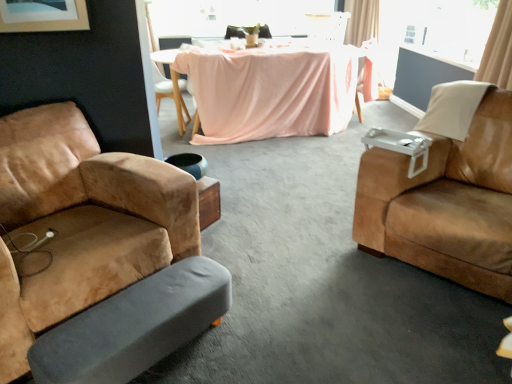
The height and width of the screenshot is (384, 512). Describe the element at coordinates (275, 89) in the screenshot. I see `pink fabric-covered table at center` at that location.

You are a GUI agent. You are given a task and a screenshot of the screen. Output one action in this format:
    pyautogui.click(x=<x>, y=<y>)
    Task: Click on the pink fabric-covered table at center
    The height and width of the screenshot is (384, 512).
    Given the screenshot: What is the action you would take?
    [x=275, y=89]

The width and height of the screenshot is (512, 384). What do you see at coordinates (446, 203) in the screenshot?
I see `suede brown couch at right, placed as the third chair when sorted from back to front` at bounding box center [446, 203].

Describe the element at coordinates (170, 95) in the screenshot. This screenshot has height=384, width=512. I see `white wood chair at upper center, which is the 4th chair in right-to-left order` at that location.

Where is `white glossy armchair at upper center`? white glossy armchair at upper center is located at coordinates (327, 26).

Is point (163, 344) behind point (355, 40)?

No, (163, 344) is in front of (355, 40).

Who is more distant, gray fabric footrest at lower left or beige fabric curtain at upper right, the 2th curtain from the bottom?

Positioned behind is beige fabric curtain at upper right, the 2th curtain from the bottom.

Based on the photo, from a real-world perspective, is gray fabric footrest at lower left physically above beige fabric curtain at upper right, positioned as the 1th curtain in back-to-front order?

No.

Starting from the beige fabric curtain at upper right, the 1th curtain when ordered from bottom to top, which chair is the 2nd one to the left? Please provide its 2D coordinates.

[(446, 203)]

Is suede brown couch at right, the 3th chair when ordered from left to right, taller or shorter than beige fabric curtain at upper right, the 2th curtain from the top?

In the image, suede brown couch at right, the 3th chair when ordered from left to right, appears to be taller than beige fabric curtain at upper right, the 2th curtain from the top.

Is suede brown couch at right, placed as the third chair when sorted from back to front, positioned before beige fabric curtain at upper right, which is the 1th curtain in front-to-back order?

Yes, suede brown couch at right, placed as the third chair when sorted from back to front, is closer to the camera.

Measure the distance from pink fabric-covered table at center to suede brown couch at right, placed as the third chair when sorted from back to front.

pink fabric-covered table at center is 6.80 feet away from suede brown couch at right, placed as the third chair when sorted from back to front.

Is pink fabric-covered table at center at the right side of suede brown couch at right, placed as the third chair when sorted from back to front?

In fact, pink fabric-covered table at center is to the left of suede brown couch at right, placed as the third chair when sorted from back to front.

Are pink fabric-covered table at center and suede brown couch at right, the 3th chair when ordered from left to right, making contact?

No, pink fabric-covered table at center is not making contact with suede brown couch at right, the 3th chair when ordered from left to right.

Consider the image. From the image's perspective, who appears lower, pink fabric-covered table at center or suede brown couch at right, the 3th chair when ordered from left to right?

suede brown couch at right, the 3th chair when ordered from left to right, from the image's perspective.

Which object is wider, suede brown couch at right, acting as the second chair starting from the front, or pink fabric-covered table at center?

Wider between the two is suede brown couch at right, acting as the second chair starting from the front.

Which of these two, suede brown couch at right, the 3th chair when ordered from left to right, or pink fabric-covered table at center, stands taller?

suede brown couch at right, the 3th chair when ordered from left to right, is taller.

From a real-world perspective, is suede brown couch at right, placed as the third chair when sorted from back to front, beneath pink fabric-covered table at center?

Incorrect, from a real-world perspective, suede brown couch at right, placed as the third chair when sorted from back to front, is higher than pink fabric-covered table at center.

Considering the positions of objects suede brown couch at right, which appears as the 2th chair when viewed from the right, and pink fabric-covered table at center in the image provided, who is behind, suede brown couch at right, which appears as the 2th chair when viewed from the right, or pink fabric-covered table at center?

pink fabric-covered table at center.

Is wooden picture frame at upper left next to white glossy armchair at upper center and touching it?

They are not placed beside each other.

Is wooden picture frame at upper left turned away from white glossy armchair at upper center?

No, white glossy armchair at upper center is not at the back of wooden picture frame at upper left.

Between wooden picture frame at upper left and white glossy armchair at upper center, which one has smaller size?

wooden picture frame at upper left.

The image size is (512, 384). Identify the location of armchair on the right side of wooden picture frame at upper left. click(327, 26).

Relative to pink fabric-covered table at center, is beige fabric curtain at upper right, the 2th curtain from the bottom, in front or behind?

In the image, beige fabric curtain at upper right, the 2th curtain from the bottom, appears behind pink fabric-covered table at center.

Locate an element on the screen. This screenshot has height=384, width=512. the 1st curtain to the right of the pink fabric-covered table at center, starting your count from the anchor is located at coordinates (362, 21).

Between beige fabric curtain at upper right, the 1th curtain positioned from the top, and pink fabric-covered table at center, which one has more height?

beige fabric curtain at upper right, the 1th curtain positioned from the top.

Considering the sizes of objects beige fabric curtain at upper right, the 1th curtain positioned from the top, and pink fabric-covered table at center in the image provided, who is thinner, beige fabric curtain at upper right, the 1th curtain positioned from the top, or pink fabric-covered table at center?

With smaller width is beige fabric curtain at upper right, the 1th curtain positioned from the top.

Is matte pink fabric chair at center, which is the 4th chair in left-to-right order, inside or outside of transparent glass window at upper center?

matte pink fabric chair at center, which is the 4th chair in left-to-right order, is located beyond the bounds of transparent glass window at upper center.

Does matte pink fabric chair at center, which is the 4th chair in left-to-right order, turn towards transparent glass window at upper center?

No, matte pink fabric chair at center, which is the 4th chair in left-to-right order, is not aimed at transparent glass window at upper center.

Which of these two, matte pink fabric chair at center, which appears as the first chair when viewed from the right, or transparent glass window at upper center, is bigger?

Bigger between the two is transparent glass window at upper center.

You are a GUI agent. You are given a task and a screenshot of the screen. Output one action in this format:
    pyautogui.click(x=<x>, y=<y>)
    Task: Click on the footrest below the beige fabric curtain at upper right, positioned as the 2th curtain in front-to-back order (from the image's perspective)
    This screenshot has width=512, height=384.
    Given the screenshot: What is the action you would take?
    pyautogui.click(x=134, y=326)

Starting from the beige fabric curtain at upper right, the 2th curtain from the back, which chair is the 2nd one to the left? Please provide its 2D coordinates.

[(446, 203)]

From the image, which object appears to be farther from beige fabric curtain at upper right, positioned as the 2th curtain in front-to-back order, beige fabric curtain at upper right, which is the 1th curtain in front-to-back order, or white glossy armchair at upper center?

beige fabric curtain at upper right, which is the 1th curtain in front-to-back order, is positioned further to the anchor beige fabric curtain at upper right, positioned as the 2th curtain in front-to-back order.

Estimate the real-world distances between objects in this image. Which object is further from suede tan armchair at left, which is the first chair in front-to-back order, beige fabric curtain at upper right, which is the 1th curtain in front-to-back order, or suede brown couch at right, acting as the second chair starting from the front?

Among the two, beige fabric curtain at upper right, which is the 1th curtain in front-to-back order, is located further to suede tan armchair at left, which is the first chair in front-to-back order.

Considering their positions, is beige fabric curtain at upper right, positioned as the 1th curtain in back-to-front order, positioned closer to wooden picture frame at upper left than white wood chair at upper center, which is counted as the second chair, starting from the back?

white wood chair at upper center, which is counted as the second chair, starting from the back, is positioned closer to the anchor wooden picture frame at upper left.

Considering their positions, is suede tan armchair at left, which is the first chair in front-to-back order, positioned further to gray fabric footrest at lower left than transparent glass window at upper center?

Based on the image, transparent glass window at upper center appears to be further to gray fabric footrest at lower left.

When comparing their distances from suede brown couch at right, acting as the second chair starting from the front, does wooden picture frame at upper left or matte pink fabric chair at center, which is the 1th chair in back-to-front order, seem further?

Among the two, matte pink fabric chair at center, which is the 1th chair in back-to-front order, is located further to suede brown couch at right, acting as the second chair starting from the front.

Which object lies nearer to the anchor point pink fabric-covered table at center, gray fabric footrest at lower left or matte pink fabric chair at center, which is the 4th chair in left-to-right order?

The object closer to pink fabric-covered table at center is matte pink fabric chair at center, which is the 4th chair in left-to-right order.

Based on their spatial positions, is gray fabric footrest at lower left or wooden picture frame at upper left closer to beige fabric curtain at upper right, positioned as the 2th curtain in front-to-back order?

wooden picture frame at upper left is closer to beige fabric curtain at upper right, positioned as the 2th curtain in front-to-back order.

When comparing their distances from gray fabric footrest at lower left, does matte pink fabric chair at center, which is the 4th chair in left-to-right order, or white glossy armchair at upper center seem further?

white glossy armchair at upper center lies further to gray fabric footrest at lower left than the other object.

The height and width of the screenshot is (384, 512). Identify the location of armchair positioned between pink fabric-covered table at center and beige fabric curtain at upper right, the 2th curtain from the bottom, from near to far. (327, 26).

This screenshot has width=512, height=384. Find the location of `curtain positioned between suede brown couch at right, the 3th chair when ordered from left to right, and beige fabric curtain at upper right, positioned as the 2th curtain in front-to-back order, from near to far`. curtain positioned between suede brown couch at right, the 3th chair when ordered from left to right, and beige fabric curtain at upper right, positioned as the 2th curtain in front-to-back order, from near to far is located at coordinates pyautogui.click(x=498, y=50).

The height and width of the screenshot is (384, 512). Find the location of `footrest between suede tan armchair at left, placed as the 3th chair when sorted from right to left, and beige fabric curtain at upper right, the 1th curtain positioned from the top, in the front-back direction`. footrest between suede tan armchair at left, placed as the 3th chair when sorted from right to left, and beige fabric curtain at upper right, the 1th curtain positioned from the top, in the front-back direction is located at coordinates (134, 326).

The width and height of the screenshot is (512, 384). I want to click on table positioned between suede tan armchair at left, placed as the 3th chair when sorted from right to left, and matte pink fabric chair at center, which is the 4th chair in left-to-right order, from near to far, so click(275, 89).